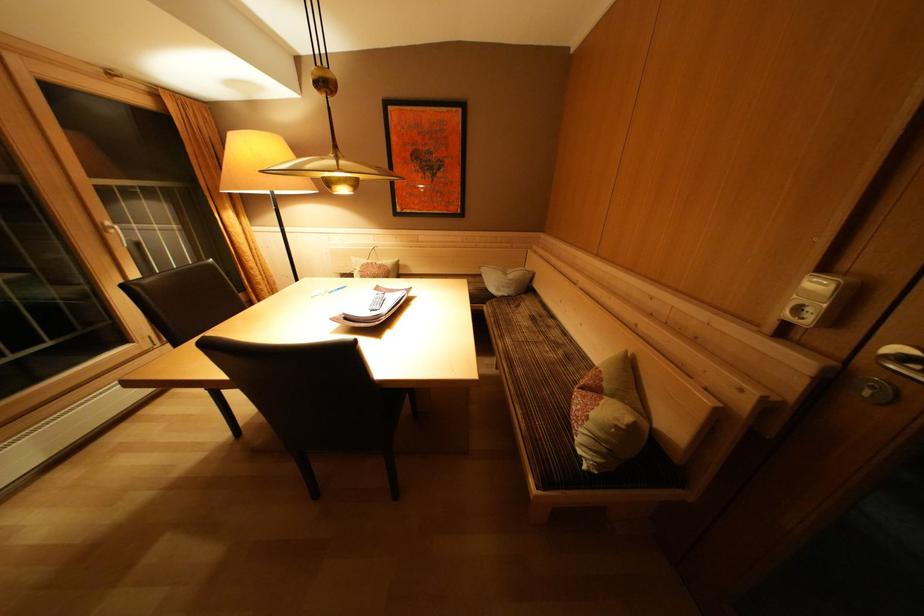
The height and width of the screenshot is (616, 924). In order to click on silver door handle in this screenshot , I will do `click(897, 349)`.